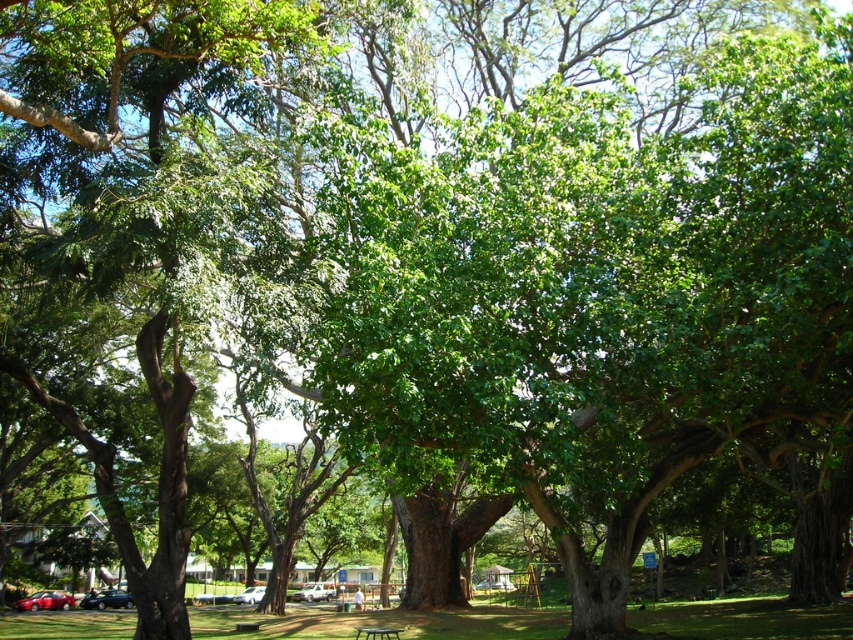
Question: Is shiny red sedan at lower left wider than black plastic bench at center?

Choices:
 (A) yes
 (B) no

Answer: (A)

Question: Which point is closer to the camera?

Choices:
 (A) (380, 632)
 (B) (57, 602)

Answer: (A)

Question: Does shiny red sedan at lower left have a smaller size compared to black plastic bench at center?

Choices:
 (A) no
 (B) yes

Answer: (A)

Question: Is shiny red sedan at lower left positioned at the back of black plastic bench at center?

Choices:
 (A) yes
 (B) no

Answer: (A)

Question: Among these points, which one is nearest to the camera?

Choices:
 (A) (364, 627)
 (B) (35, 600)

Answer: (A)